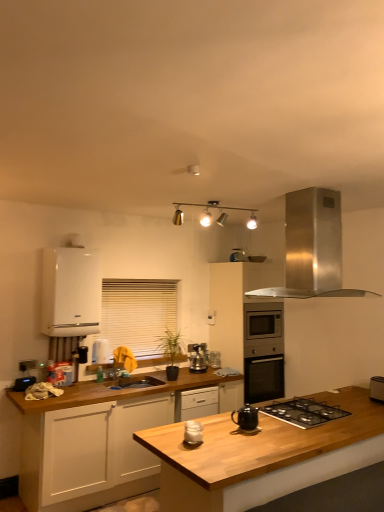
Identify the location of vacant region above white blinds at center (from a real-world perspective). tap(135, 278).